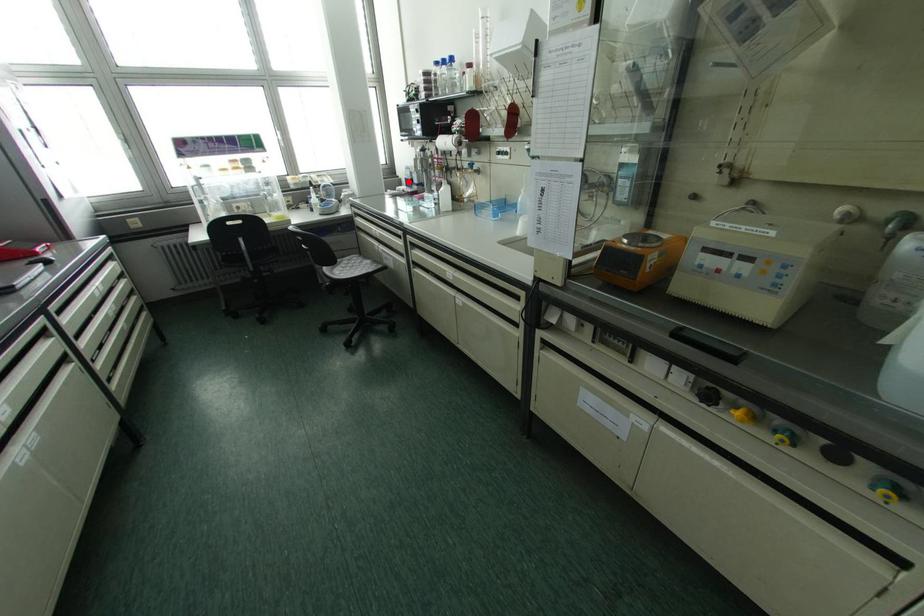
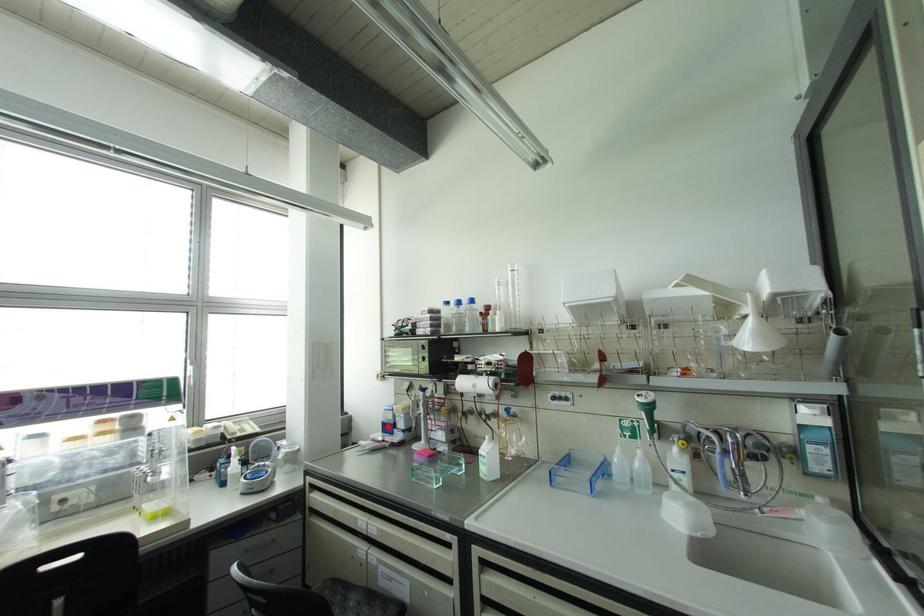
I am providing you with two images of the same scene from different viewpoints. A red point is marked on the first image and another point is marked on the second image. Is the red point in image1 aligned with the point shown in image2?

Yes